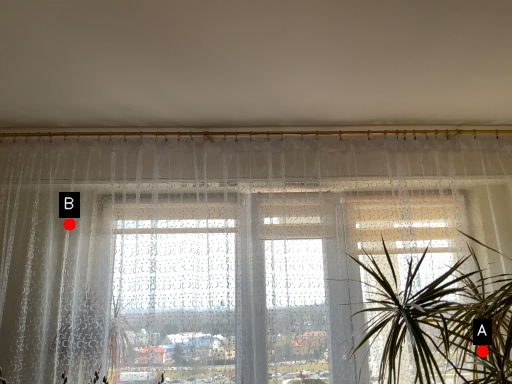
Question: Two points are circled on the image, labeled by A and B beside each circle. Which of the following is the closest to the observer?

Choices:
 (A) A is closer
 (B) B is closer

Answer: (A)